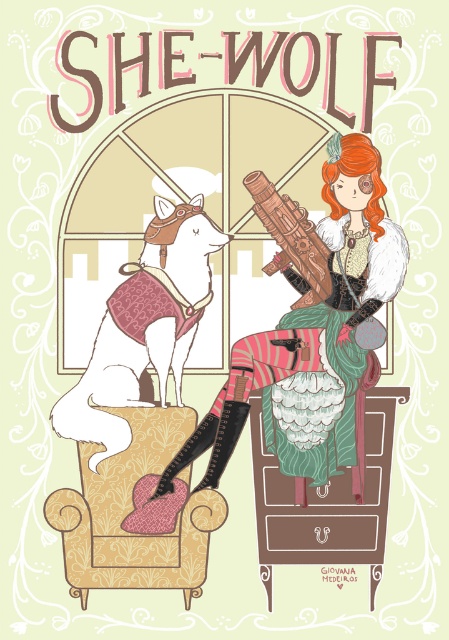
In the scene shown: You are an art appraiser examining the two guns in the image. Which gun, the matte brown gun at center or the wooden carved gun at center, is positioned closer to the viewer?

The matte brown gun at center is closer to the viewer than the wooden carved gun at center.

You are standing in the room depicted in the image. There is a patterned fabric armchair at center. Can you determine its exact location based on the coordinate system provided?

The patterned fabric armchair at center is located at point (133, 513) according to the coordinate system provided.